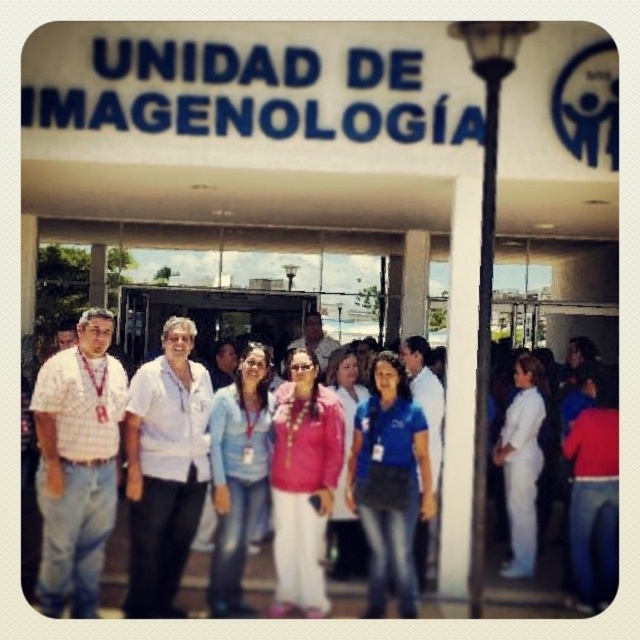
The width and height of the screenshot is (640, 640). Identify the location of white matte shirt at center. (164, 468).

From the picture: Does white matte shirt at center appear on the right side of blue jeans at center?

Incorrect, white matte shirt at center is not on the right side of blue jeans at center.

Which is in front, point (179, 339) or point (241, 483)?

Point (179, 339) is in front.

Identify the location of white matte shirt at center. This screenshot has height=640, width=640. (164, 468).

Is blue jeans at center to the right of white smooth uniform at right from the viewer's perspective?

In fact, blue jeans at center is to the left of white smooth uniform at right.

Describe the element at coordinates (237, 474) in the screenshot. The width and height of the screenshot is (640, 640). I see `blue jeans at center` at that location.

Image resolution: width=640 pixels, height=640 pixels. Find the location of `blue jeans at center`. blue jeans at center is located at coordinates (237, 474).

Looking at this image, can you confirm if white matte shirt at center is shorter than white smooth uniform at right?

No.

Is point (200, 461) positioned in front of point (512, 532)?

Yes, it is.

Between point (173, 435) and point (520, 570), which one is positioned behind?

The point (520, 570) is behind.

What are the coordinates of `white matte shirt at center` in the screenshot? It's located at (164, 468).